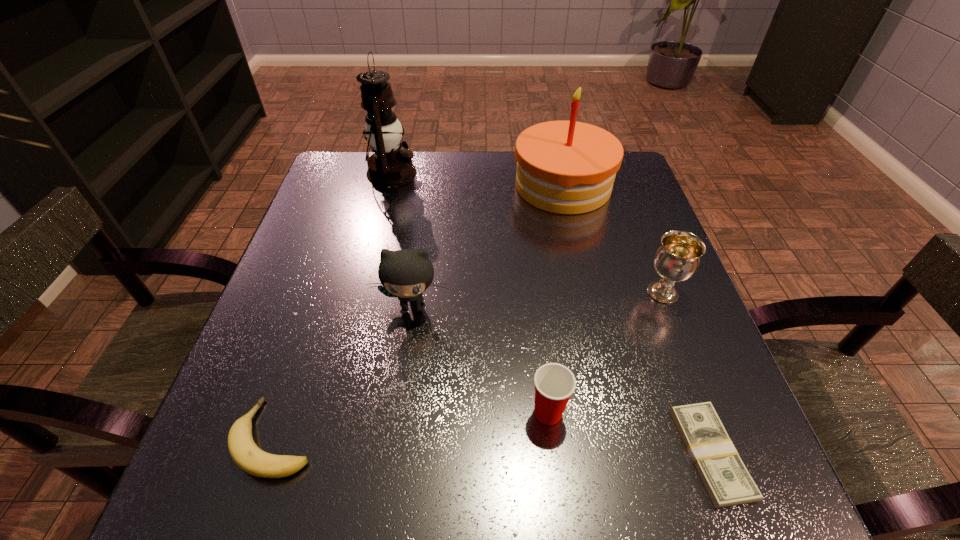
At what (x,y) coordinates should I click in order to perform the action: click on vacant space that satisfies the following two spatial constraints: 1. on the side of the lantern, there is a wick adjustment knob; 2. on the back side of the Dixie cup. Please return your answer as a coordinate pair (x, y). Looking at the image, I should click on (331, 413).

Identify the location of vacant point that satisfies the following two spatial constraints: 1. on the side of the tallest object, there is a wick adjustment knob; 2. on the right side of the second tallest object. Image resolution: width=960 pixels, height=540 pixels. point(389,186).

Where is `vacant space that satisfies the following two spatial constraints: 1. on the back side of the chalice; 2. on the left side of the Dixie cup`? The height and width of the screenshot is (540, 960). vacant space that satisfies the following two spatial constraints: 1. on the back side of the chalice; 2. on the left side of the Dixie cup is located at coordinates (535, 293).

I want to click on vacant area in the image that satisfies the following two spatial constraints: 1. on the side of the third shortest object, there is a wick adjustment knob; 2. on the right side of the lantern, so click(x=331, y=413).